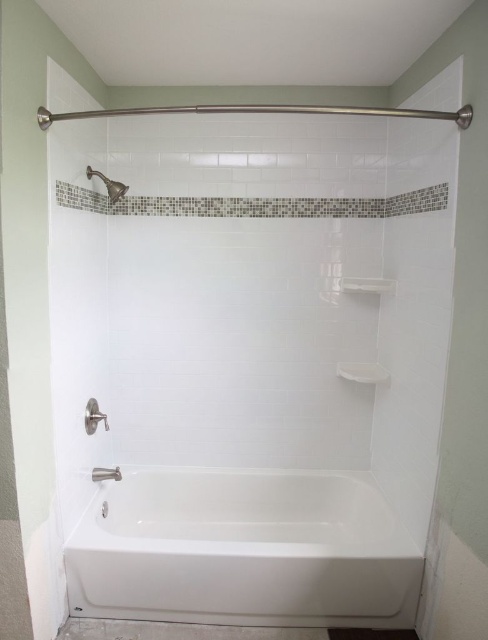
Is the position of white ceramic bathtub at lower center more distant than that of white glossy shelf at upper center?

No, it is in front of white glossy shelf at upper center.

Which is in front, point (78, 604) or point (341, 372)?

Positioned in front is point (78, 604).

Image resolution: width=488 pixels, height=640 pixels. Find the location of `white ceramic bathtub at lower center`. white ceramic bathtub at lower center is located at coordinates (243, 550).

Is white glossy shelf at upper center thinner than brushed metal showerhead at upper left?

In fact, white glossy shelf at upper center might be wider than brushed metal showerhead at upper left.

Is white glossy shelf at upper center below brushed metal showerhead at upper left?

Correct, white glossy shelf at upper center is located below brushed metal showerhead at upper left.

Find the location of `white glossy shelf at upper center`. white glossy shelf at upper center is located at coordinates (363, 372).

Can you confirm if white ceramic bathtub at lower center is positioned below brushed metal showerhead at upper left?

Indeed, white ceramic bathtub at lower center is positioned under brushed metal showerhead at upper left.

Where is `white ceramic bathtub at lower center`? This screenshot has width=488, height=640. white ceramic bathtub at lower center is located at coordinates (243, 550).